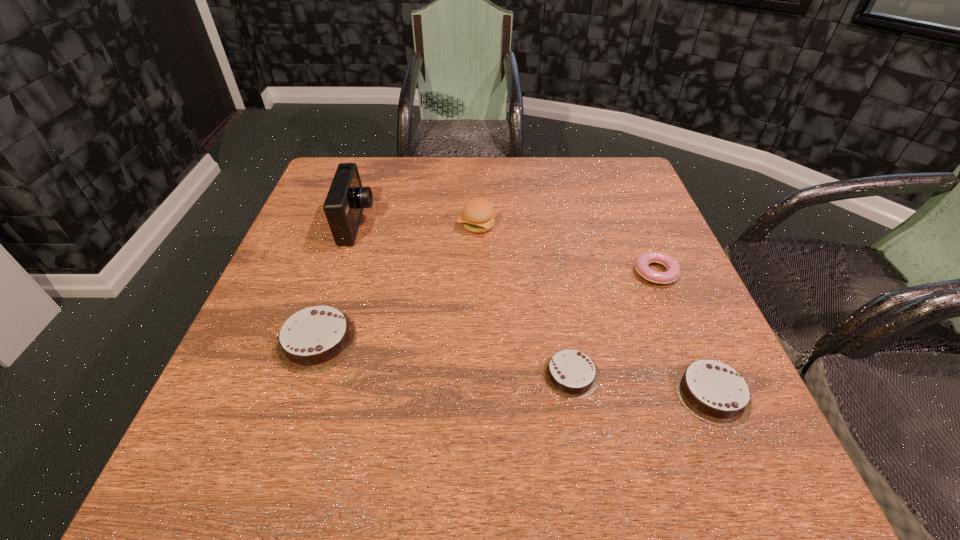
Identify the location of free space between the fourth nearest object and the fourth object from left to right. (613, 323).

The width and height of the screenshot is (960, 540). What are the coordinates of `free space between the leftmost chocolate cake and the camera` in the screenshot? It's located at (337, 282).

Locate an element on the screen. Image resolution: width=960 pixels, height=540 pixels. vacant space in between the third tallest object and the second chocolate cake from left to right is located at coordinates (444, 357).

Find the location of `free spot between the third object from left to right and the second tallest chocolate cake`. free spot between the third object from left to right and the second tallest chocolate cake is located at coordinates (595, 309).

Locate an element on the screen. The image size is (960, 540). free space between the tallest object and the second chocolate cake from left to right is located at coordinates (465, 299).

This screenshot has height=540, width=960. I want to click on free spot between the tallest object and the rightmost chocolate cake, so click(535, 308).

You are a GUI agent. You are given a task and a screenshot of the screen. Output one action in this format:
    pyautogui.click(x=<x>, y=<y>)
    Task: Click on the free space between the second tallest object and the rightmost chocolate cake
    The image size is (960, 540).
    Given the screenshot: What is the action you would take?
    (595, 309)

Identify the location of object that is the closest to the third tallest object. (346, 199).

Identify which object is located as the nearest to the shortest chocolate cake. Please provide its 2D coordinates. Your answer should be formatted as a tuple, i.e. [(x, y)], where the tuple contains the x and y coordinates of a point satisfying the conditions above.

[(714, 392)]

Identify which chocolate cake is the second nearest to the tallest object. Please provide its 2D coordinates. Your answer should be formatted as a tuple, i.e. [(x, y)], where the tuple contains the x and y coordinates of a point satisfying the conditions above.

[(570, 373)]